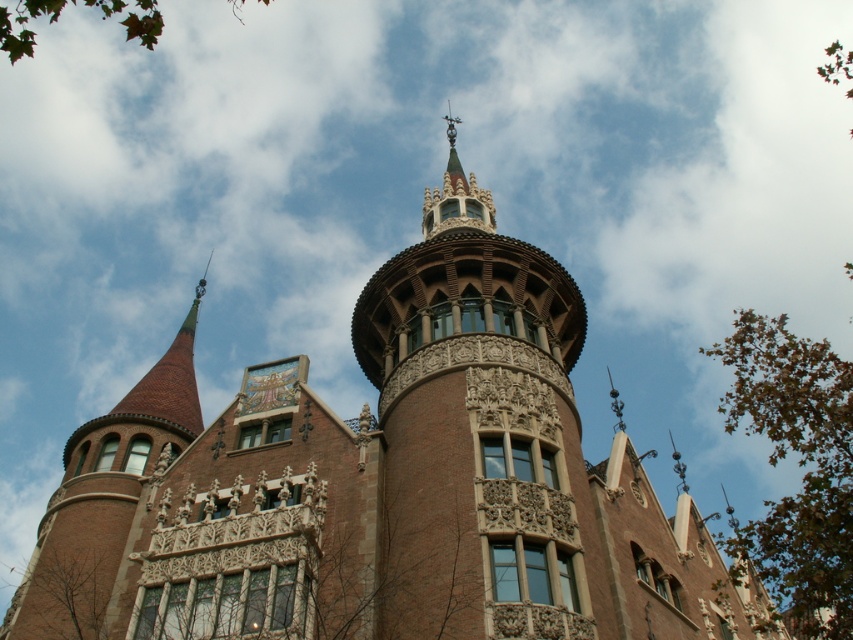
From the picture: You are an architect planning to add a new sculpture between the green leafy tree at right and the green leafy tree at upper left. Considering their sizes, which tree should the sculpture be placed closer to for visual balance?

The sculpture should be placed closer to the green leafy tree at right because it is smaller in size compared to the green leafy tree at upper left, helping to achieve visual balance between the two trees.

You are standing in front of the architectural structure and want to take a photo of the green leafy tree at right and the brown textured tree at lower left. Which tree will appear closer to you in the photo?

The green leafy tree at right will appear closer to you in the photo because it is positioned in front of the brown textured tree at lower left.